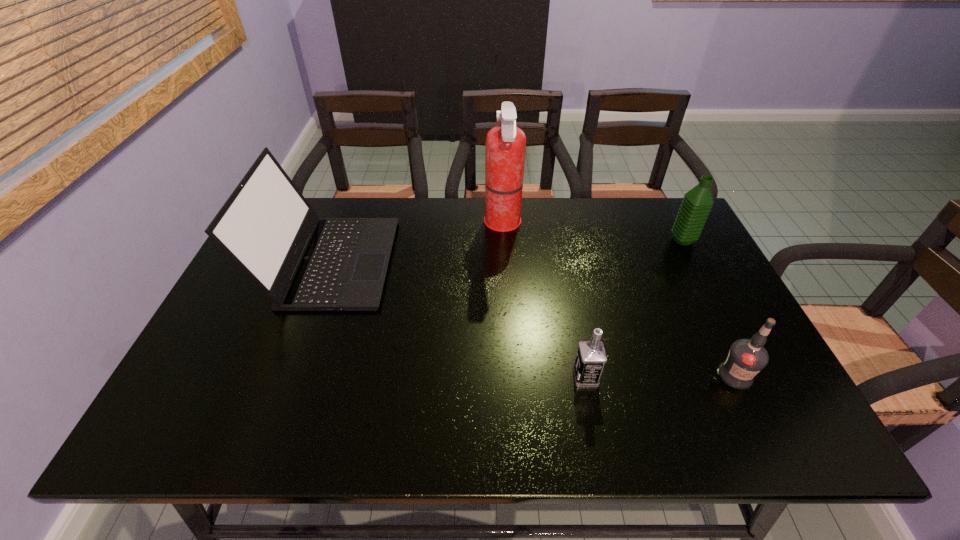
Find the location of a particular element. free space between the water bottle and the taller vodka is located at coordinates (708, 308).

The height and width of the screenshot is (540, 960). I want to click on vacant area that lies between the second object from left to right and the water bottle, so click(x=592, y=232).

You are a GUI agent. You are given a task and a screenshot of the screen. Output one action in this format:
    pyautogui.click(x=<x>, y=<y>)
    Task: Click on the free spot between the fourth shortest object and the fourth object from right to left
    This screenshot has height=540, width=960.
    Given the screenshot: What is the action you would take?
    pyautogui.click(x=417, y=243)

You are a GUI agent. You are given a task and a screenshot of the screen. Output one action in this format:
    pyautogui.click(x=<x>, y=<y>)
    Task: Click on the object that is the nearest to the water bottle
    
    Given the screenshot: What is the action you would take?
    pyautogui.click(x=746, y=358)

This screenshot has width=960, height=540. Identify the location of object that is the fourth closest one to the tallest object. (746, 358).

What are the coordinates of `free location that satisfies the following two spatial constraints: 1. on the front label of the right vodka; 2. on the front label of the left vodka` in the screenshot? It's located at (735, 377).

Locate an element on the screen. This screenshot has width=960, height=540. free region that satisfies the following two spatial constraints: 1. with the handle and hose on the water bottle; 2. on the left side of the fourth object from right to left is located at coordinates (504, 240).

The width and height of the screenshot is (960, 540). Identify the location of vacant region that satisfies the following two spatial constraints: 1. on the front side of the water bottle; 2. on the surface of the laptop. (x=694, y=262).

Locate an element on the screen. This screenshot has height=540, width=960. vacant area that satisfies the following two spatial constraints: 1. with the handle and hose on the tallest object; 2. on the back side of the water bottle is located at coordinates (504, 240).